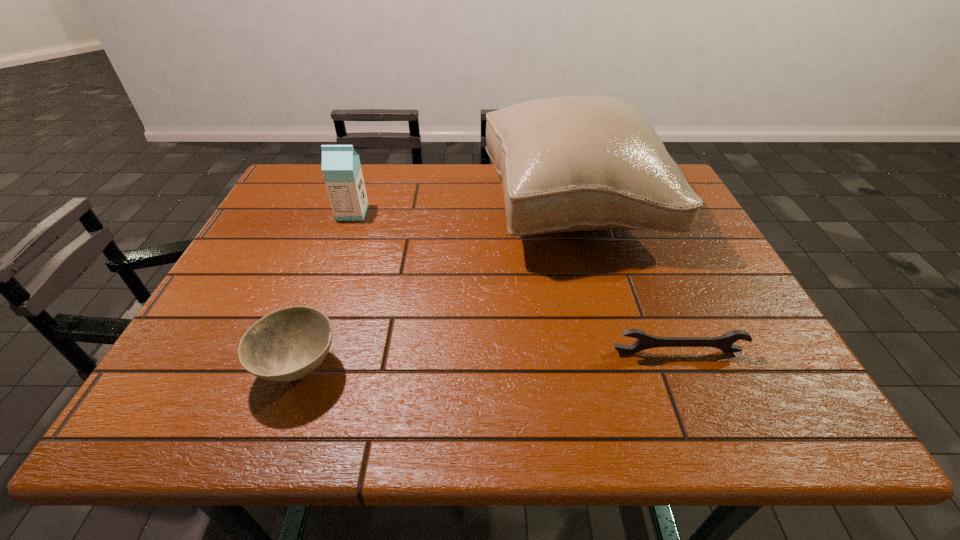
Find the location of a particular element. the tallest object is located at coordinates (572, 163).

The image size is (960, 540). Find the location of `milk carton`. milk carton is located at coordinates (341, 168).

At what (x,y) coordinates should I click in order to perform the action: click on the second shortest object. Please return your answer as a coordinate pair (x, y). The image size is (960, 540). Looking at the image, I should click on (288, 344).

In order to click on the shortest object in this screenshot , I will do `click(645, 341)`.

The height and width of the screenshot is (540, 960). Identify the location of blank space located 0.130m on the left of the cushion. (439, 208).

At what (x,y) coordinates should I click in order to perform the action: click on free spot located on the right of the milk carton. Please return your answer as a coordinate pair (x, y). The image size is (960, 540). Looking at the image, I should click on (491, 213).

Where is `free space located 0.070m on the left of the second shortest object`? free space located 0.070m on the left of the second shortest object is located at coordinates (220, 367).

Find the location of a particular element. free spot located 0.070m on the open ends of the wrench is located at coordinates (690, 385).

Where is `cushion at the far edge`? The height and width of the screenshot is (540, 960). cushion at the far edge is located at coordinates (572, 163).

Image resolution: width=960 pixels, height=540 pixels. Find the location of `milk carton situated at the far edge`. milk carton situated at the far edge is located at coordinates (341, 168).